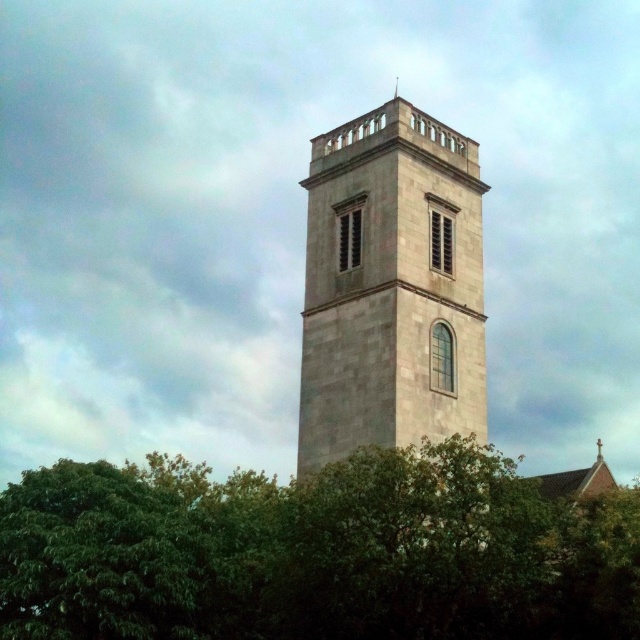
You are standing in front of the light gray stone tower at center and want to take a photo of the green leafy tree at center. Which direction should you move to ensure the tree is fully visible in your frame?

The green leafy tree at center is positioned on the left side of light gray stone tower at center. To ensure the tree is fully visible, you should move to the right side of the tower so that the tree comes into view on the left.